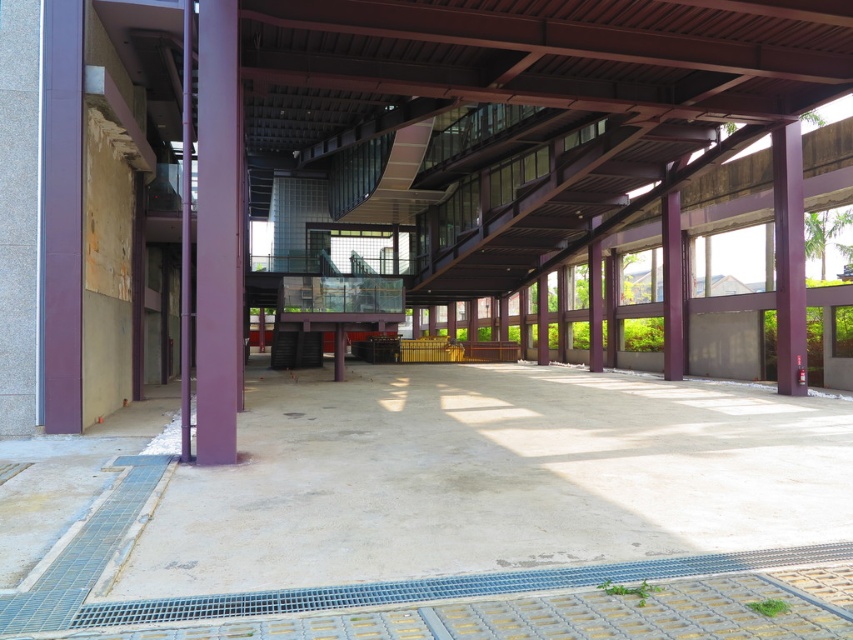
Question: Estimate the real-world distances between objects in this image. Which object is closer to the purple matte/finish pillar at left?

Choices:
 (A) gray concrete grate at lower center
 (B) purple matte/finish pillar at center

Answer: (A)

Question: Which object is closer to the camera taking this photo?

Choices:
 (A) purple matte/finish pillar at right
 (B) purple matte/finish pillar at left
 (C) purple matte/finish pillar at center
 (D) purple matte/finish pillar at center-right

Answer: (B)

Question: Is gray concrete grate at lower center below purple matte/finish pillar at center?

Choices:
 (A) no
 (B) yes

Answer: (B)

Question: Considering the relative positions of purple matte/finish pillar at left and purple matte/finish pillar at center-right in the image provided, where is purple matte/finish pillar at left located with respect to purple matte/finish pillar at center-right?

Choices:
 (A) below
 (B) above

Answer: (A)

Question: Based on their relative distances, which object is farther from the gray concrete grate at lower center?

Choices:
 (A) purple matte/finish pillar at right
 (B) purple matte/finish pillar at center-right
 (C) purple matte/finish pillar at left

Answer: (B)

Question: Can you confirm if purple matte/finish pillar at left is positioned below purple matte/finish pillar at center-right?

Choices:
 (A) yes
 (B) no

Answer: (A)